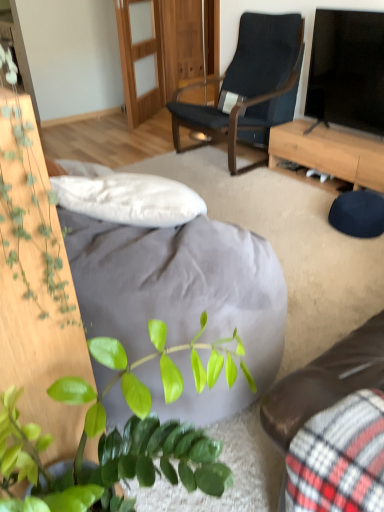
This screenshot has width=384, height=512. What do you see at coordinates (325, 381) in the screenshot? I see `velvet plaid studio couch at lower right` at bounding box center [325, 381].

The height and width of the screenshot is (512, 384). Describe the element at coordinates (28, 210) in the screenshot. I see `green leafy plant at left` at that location.

This screenshot has width=384, height=512. Identify the location of black glossy tv at upper right. (347, 70).

The width and height of the screenshot is (384, 512). What are the coordinates of `dark blue fabric chair at upper center` in the screenshot? It's located at (250, 86).

Considering the sizes of objects green leafy plant at left and light brown wood desk at center right in the image provided, who is shorter, green leafy plant at left or light brown wood desk at center right?

With less height is light brown wood desk at center right.

Considering the sizes of objects green leafy plant at left and light brown wood desk at center right in the image provided, who is thinner, green leafy plant at left or light brown wood desk at center right?

green leafy plant at left is thinner.

From the image's perspective, which is below, green leafy plant at left or light brown wood desk at center right?

green leafy plant at left is shown below in the image.

Can we say dark blue fabric chair at upper center lies outside light brown wood desk at center right?

That's correct, dark blue fabric chair at upper center is outside of light brown wood desk at center right.

How different are the orientations of dark blue fabric chair at upper center and light brown wood desk at center right in degrees?

The angle between the facing direction of dark blue fabric chair at upper center and the facing direction of light brown wood desk at center right is 0.305 degrees.

Who is smaller, dark blue fabric chair at upper center or light brown wood desk at center right?

Smaller between the two is light brown wood desk at center right.

Image resolution: width=384 pixels, height=512 pixels. I want to click on desk below the dark blue fabric chair at upper center (from a real-world perspective), so (328, 154).

How distant is light brown wood desk at center right from green leafy plant at left?

light brown wood desk at center right is 2.20 meters away from green leafy plant at left.

Is light brown wood desk at center right with green leafy plant at left?

light brown wood desk at center right and green leafy plant at left are clearly separated.

Between light brown wood desk at center right and green leafy plant at left, which one has smaller size?

green leafy plant at left.

Would you say light brown wood desk at center right is outside green leafy plant at left?

That's correct, light brown wood desk at center right is outside of green leafy plant at left.

Which point is more forward, [260,20] or [51,247]?

The point [51,247] is more forward.

From the image's perspective, would you say dark blue fabric chair at upper center is positioned over green leafy plant at left?

Yes, from the image's perspective, dark blue fabric chair at upper center is on top of green leafy plant at left.

Which is more to the right, dark blue fabric chair at upper center or green leafy plant at left?

Positioned to the right is dark blue fabric chair at upper center.

How many degrees apart are the facing directions of dark blue fabric chair at upper center and green leafy plant at left?

The angular difference between dark blue fabric chair at upper center and green leafy plant at left is 180 degrees.

Would you say green matte plant at lower left is a long distance from green leafy plant at left?

No, green matte plant at lower left is in close proximity to green leafy plant at left.

You are a GUI agent. You are given a task and a screenshot of the screen. Output one action in this format:
    pyautogui.click(x=<x>, y=<y>)
    Task: Click on the vegetation above the green matte plant at lower left (from a real-world perspective)
    
    Given the screenshot: What is the action you would take?
    pyautogui.click(x=28, y=210)

In the image, is green matte plant at lower left positioned in front of or behind green leafy plant at left?

green matte plant at lower left is positioned farther from the viewer than green leafy plant at left.

Does point (49, 226) appear closer or farther from the camera than point (48, 210)?

Point (49, 226).

From a real-world perspective, which object rests below the other?

In real-world perspective, green matte plant at lower left is lower.

Visually, is velvet plaid studio couch at lower right positioned to the left or to the right of green matte plant at lower left?

Clearly, velvet plaid studio couch at lower right is on the right of green matte plant at lower left in the image.

Is velvet plaid studio couch at lower right far from green matte plant at lower left?

No, velvet plaid studio couch at lower right is in close proximity to green matte plant at lower left.

From the image's perspective, which one is positioned higher, velvet plaid studio couch at lower right or green matte plant at lower left?

green matte plant at lower left appears higher in the image.

Between velvet plaid studio couch at lower right and dark blue fabric chair at upper center, which one has smaller width?

velvet plaid studio couch at lower right.

Between velvet plaid studio couch at lower right and dark blue fabric chair at upper center, which one is positioned behind?

dark blue fabric chair at upper center is further away from the camera.

From a real-world perspective, is velvet plaid studio couch at lower right over dark blue fabric chair at upper center?

Incorrect, from a real-world perspective, velvet plaid studio couch at lower right is lower than dark blue fabric chair at upper center.

Is velvet plaid studio couch at lower right not inside dark blue fabric chair at upper center?

Absolutely, velvet plaid studio couch at lower right is external to dark blue fabric chair at upper center.

Identify the location of vegetation in front of the light brown wood desk at center right. (28, 210).

What are the coordinates of `desk on the right of dark blue fabric chair at upper center` in the screenshot? It's located at (328, 154).

When comparing their distances from dark blue fabric chair at upper center, does light brown wood desk at center right or green leafy plant at left seem further?

green leafy plant at left lies further to dark blue fabric chair at upper center than the other object.

When comparing their distances from velvet plaid studio couch at lower right, does green leafy plant at left or light brown wood desk at center right seem closer?

green leafy plant at left is positioned closer to the anchor velvet plaid studio couch at lower right.

Looking at the image, which one is located closer to dark blue fabric chair at upper center, light brown wood desk at center right or black glossy tv at upper right?

light brown wood desk at center right lies closer to dark blue fabric chair at upper center than the other object.

When comparing their distances from black glossy tv at upper right, does light brown wood desk at center right or green matte plant at lower left seem further?

green matte plant at lower left.

Based on their spatial positions, is velvet plaid studio couch at lower right or black glossy tv at upper right further from light brown wood desk at center right?

velvet plaid studio couch at lower right is positioned further to the anchor light brown wood desk at center right.

Based on their spatial positions, is black glossy tv at upper right or dark blue fabric chair at upper center closer to green matte plant at lower left?

The object closer to green matte plant at lower left is black glossy tv at upper right.

In the scene shown: Estimate the real-world distances between objects in this image. Which object is further from velvet plaid studio couch at lower right, light brown wood desk at center right or dark blue fabric chair at upper center?

dark blue fabric chair at upper center is positioned further to the anchor velvet plaid studio couch at lower right.

Looking at this image, based on their spatial positions, is green matte plant at lower left or velvet plaid studio couch at lower right further from black glossy tv at upper right?

green matte plant at lower left.

At what (x,y) coordinates should I click in order to perform the action: click on desk between velvet plaid studio couch at lower right and dark blue fabric chair at upper center along the z-axis. Please return your answer as a coordinate pair (x, y). Looking at the image, I should click on (328, 154).

This screenshot has height=512, width=384. Identify the location of houseplant between green leafy plant at left and light brown wood desk at center right from front to back. (48, 445).

Image resolution: width=384 pixels, height=512 pixels. I want to click on houseplant between velvet plaid studio couch at lower right and dark blue fabric chair at upper center in the front-back direction, so click(48, 445).

This screenshot has width=384, height=512. What are the coordinates of `vegetation located between velvet plaid studio couch at lower right and dark blue fabric chair at upper center in the depth direction` in the screenshot? It's located at (28, 210).